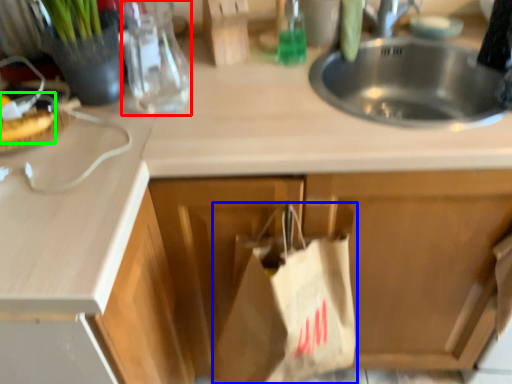
Question: Which object is positioned closest to bottle (highlighted by a red box)? Select from grocery bag (highlighted by a blue box) and food (highlighted by a green box).

Choices:
 (A) grocery bag
 (B) food

Answer: (B)